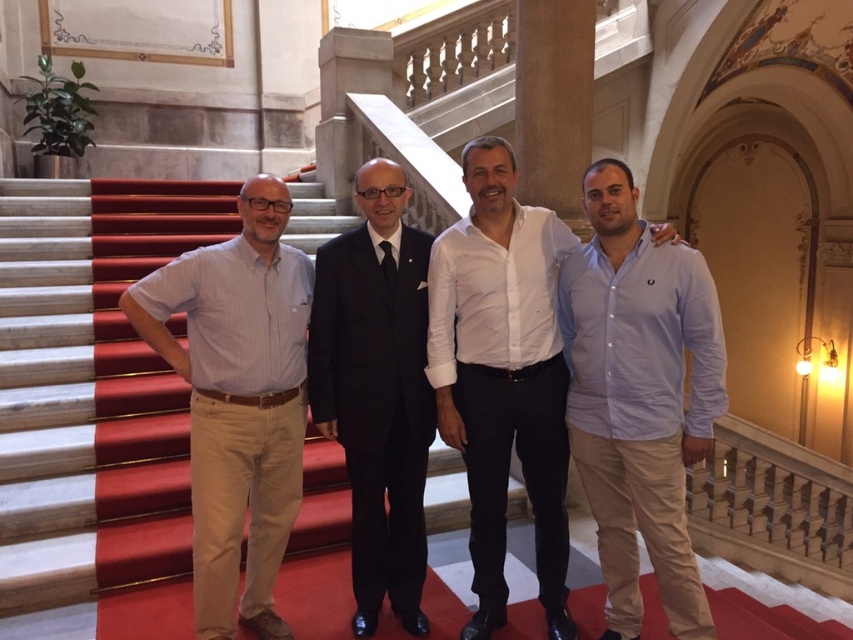
You are a photographer standing at the bottom of the staircase. You want to take a photo of the light blue striped shirt at left and the black suit at center. The camera you are using has a maximum focus range of 12 inches. Can you capture both subjects in focus without moving closer?

The distance between the light blue striped shirt at left and the black suit at center is 11.90 inches, which is within the camera maximum focus range of 12 inches. Therefore, you can capture both subjects in focus without moving closer.

You are standing in the same room as the group of men. You need to locate the light blue striped shirt at left. Where exactly is it positioned relative to the staircase?

The light blue striped shirt at left is located at point 0.627 on the x axis and 0.280 on the y axis relative to the staircase.

You are standing in front of the grand staircase in the image. There are two points marked on the floor near the staircase. The first point is at coordinate point [697,356] and the second point is at coordinate point [492,310]. Which point is closer to you?

Point [697,356] is closer to the camera than point [492,310], so the first point is closer to you.